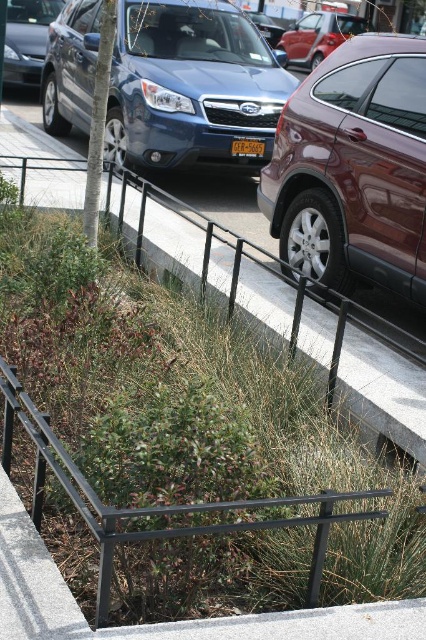
Question: Which object is the farthest from the matte blue car at center?

Choices:
 (A) metallic red car at center
 (B) shiny metallic sedan at upper left
 (C) shiny maroon suv at center

Answer: (A)

Question: Which point is closer to the camera?

Choices:
 (A) [411, 92]
 (B) [11, 38]
 (C) [51, 58]

Answer: (A)

Question: Can you confirm if shiny maroon suv at center is positioned to the right of metallic red car at center?

Choices:
 (A) no
 (B) yes

Answer: (A)

Question: Where is shiny maroon suv at center located in relation to metallic red car at center in the image?

Choices:
 (A) left
 (B) right

Answer: (A)

Question: Which point is closer to the camera taking this photo?

Choices:
 (A) (350, 19)
 (B) (209, 100)

Answer: (B)

Question: In this image, where is shiny maroon suv at center located relative to metallic red car at center?

Choices:
 (A) below
 (B) above

Answer: (A)